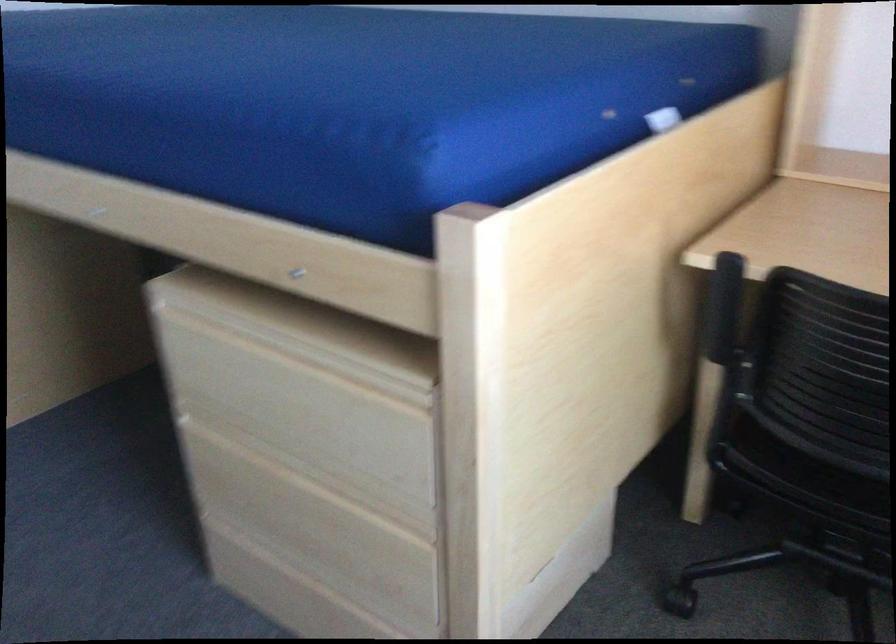
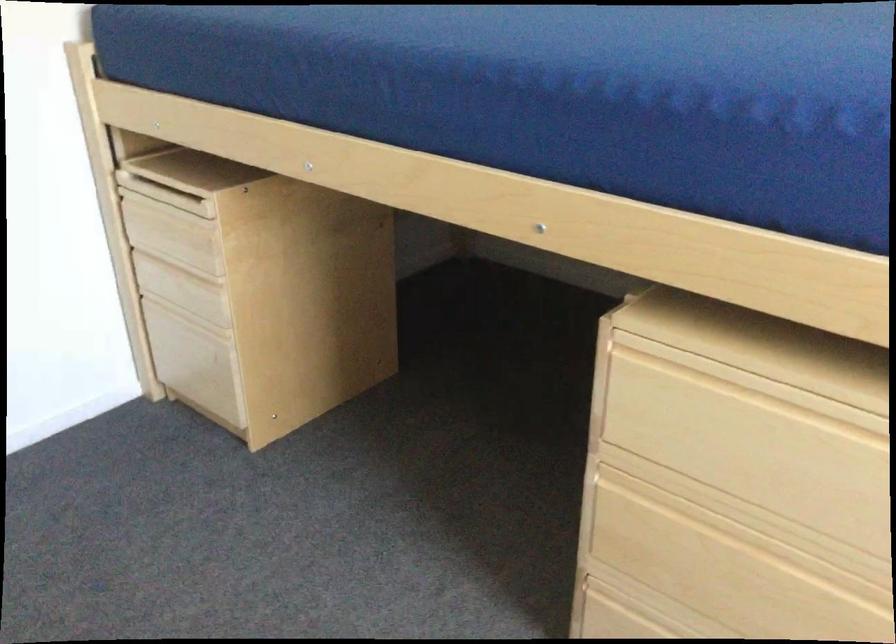
Question: How did the camera likely rotate?

Choices:
 (A) Left
 (B) Right
 (C) Up
 (D) Down

Answer: (A)